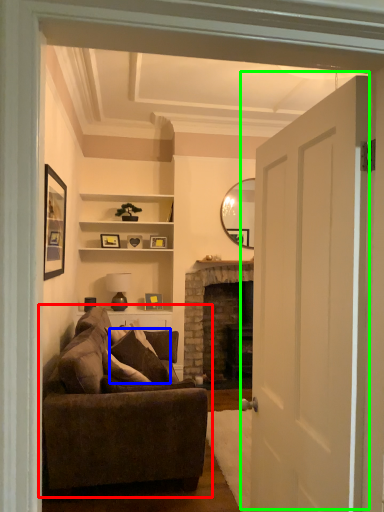
Question: Which object is positioned farthest from studio couch (highlighted by a red box)? Select from pillow (highlighted by a blue box) and door (highlighted by a green box).

Choices:
 (A) pillow
 (B) door

Answer: (B)